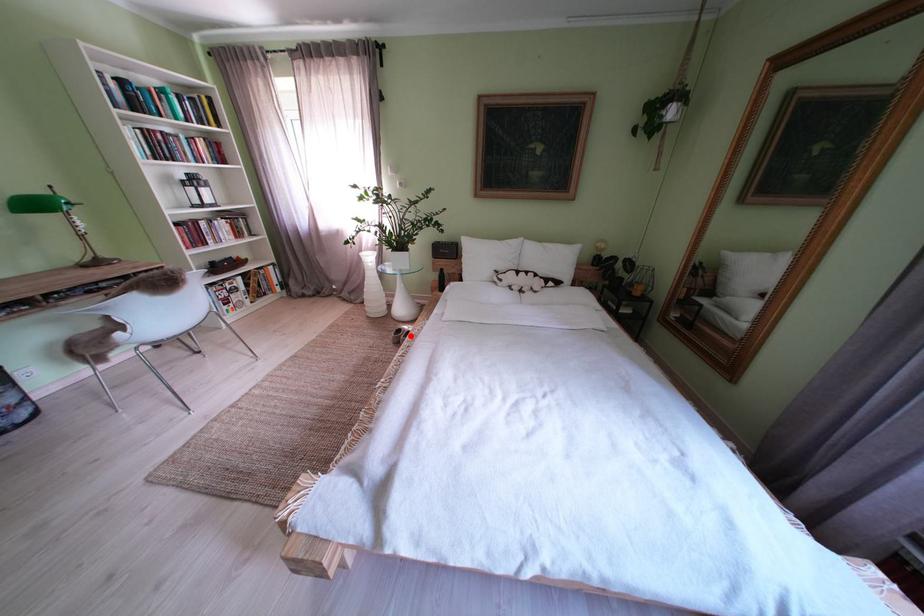
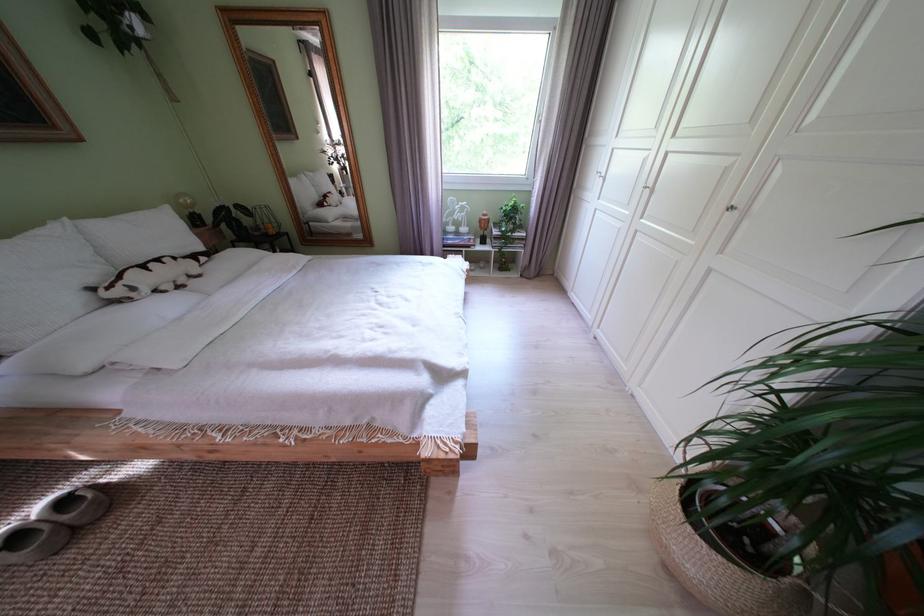
Find the pixel in the second image that matches the highlighted location in the first image.

(28, 543)